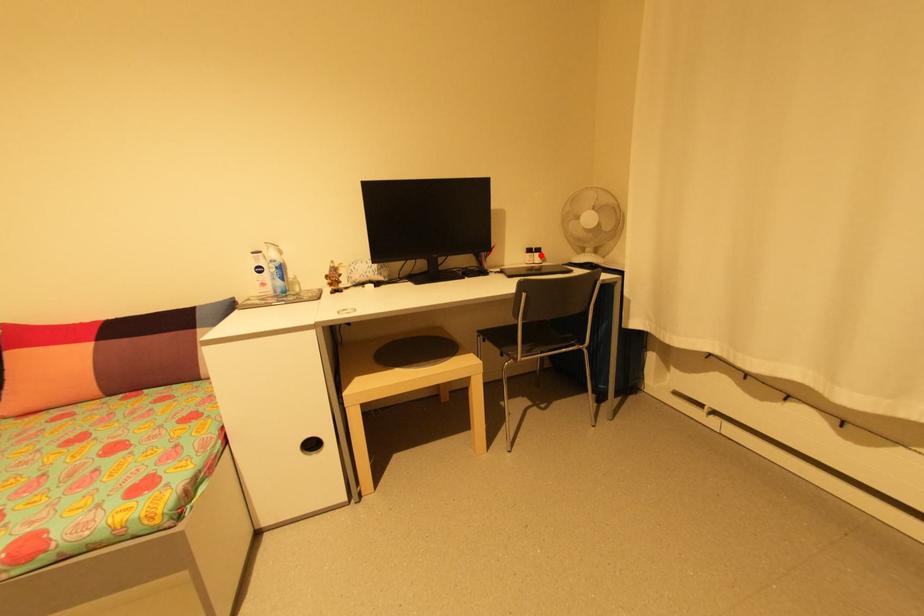
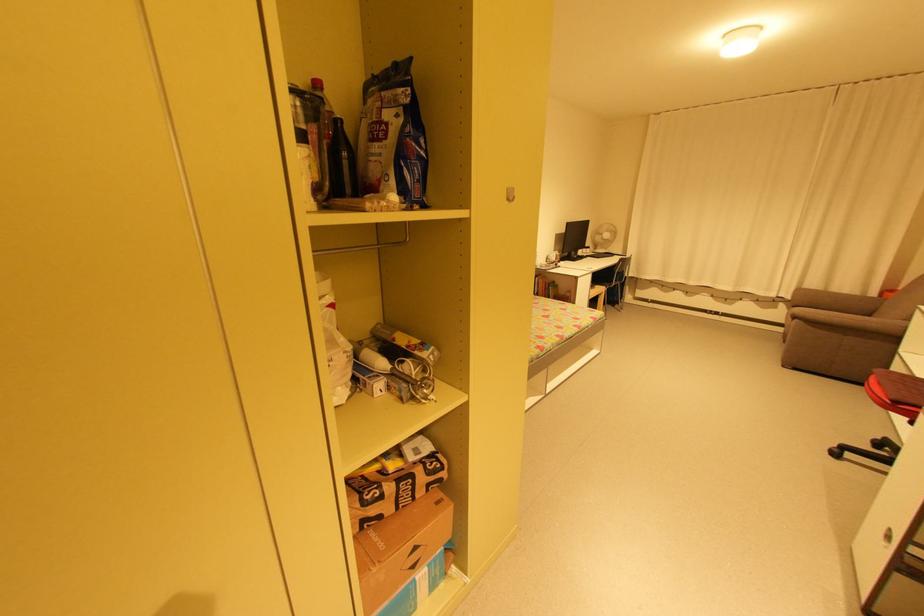
Find the pixel in the second image that matches the highlighted location in the first image.

(592, 249)